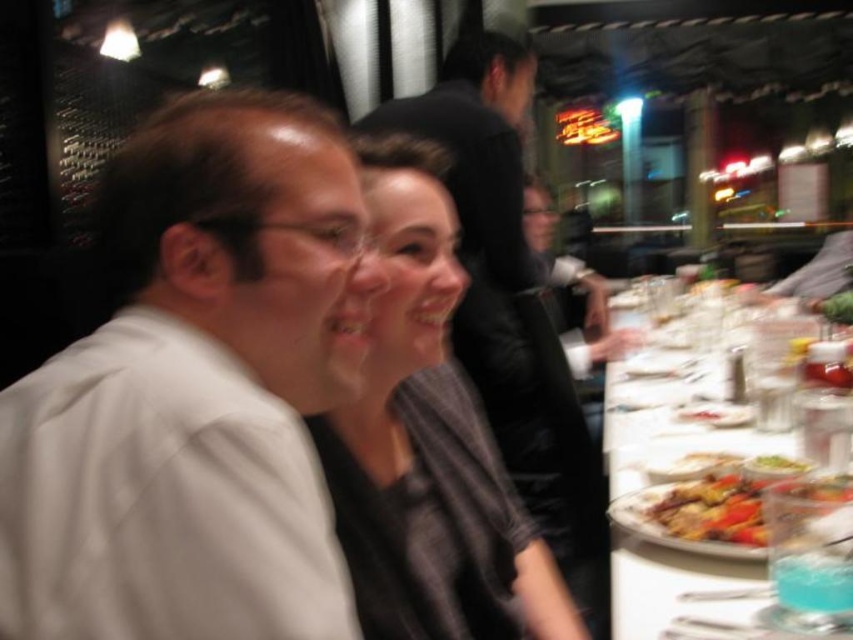
Can you confirm if white matte shirt at left is wider than matte black shirt at center?

Incorrect, white matte shirt at left's width does not surpass matte black shirt at center's.

Which is in front, point (293, 422) or point (405, 596)?

Point (293, 422)

Between point (135, 205) and point (480, 627), which one is positioned in front?

Point (135, 205) is more forward.

I want to click on white matte shirt at left, so click(196, 392).

Is point (764, 461) closer to camera compared to point (728, 472)?

No, it is not.

Is point (743, 464) positioned after point (700, 508)?

Yes, point (743, 464) is behind point (700, 508).

Locate an element on the screen. The width and height of the screenshot is (853, 640). golden brown crispy chicken at right is located at coordinates (721, 502).

Which is below, white matte shirt at left or shiny golden plate at lower right?

shiny golden plate at lower right

Based on the photo, which of these two, white matte shirt at left or shiny golden plate at lower right, stands taller?

Standing taller between the two is white matte shirt at left.

Is point (241, 200) more distant than point (747, 508)?

No, it is in front of (747, 508).

Identify the location of white matte shirt at left. (196, 392).